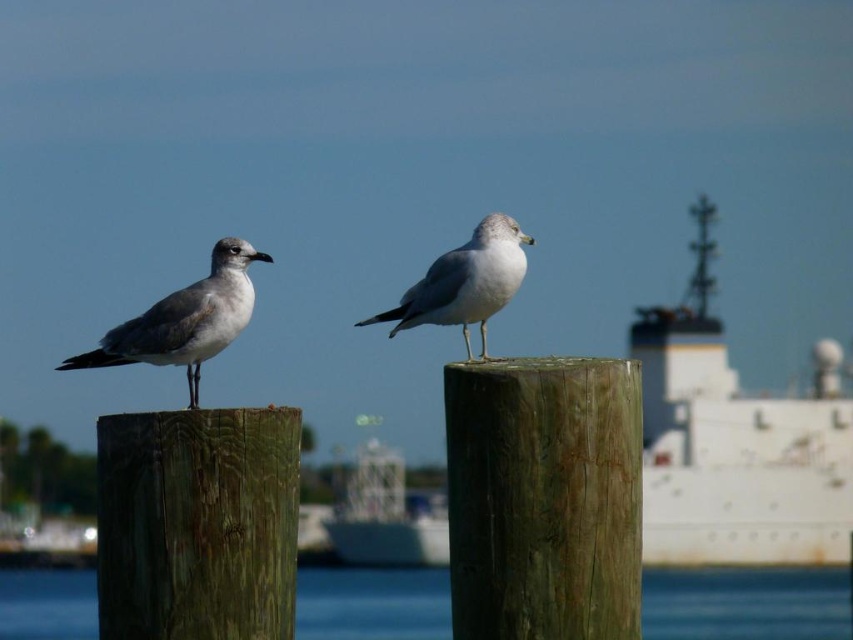
Does green weathered wood post at center lie in front of gray matte seagull at left?

Yes.

Can you confirm if green weathered wood post at center is shorter than gray matte seagull at left?

No, green weathered wood post at center is not shorter than gray matte seagull at left.

Where is `green weathered wood post at center`? The width and height of the screenshot is (853, 640). green weathered wood post at center is located at coordinates (543, 497).

Is gray matte seagull at left below white matte seagull at center?

Indeed, gray matte seagull at left is positioned under white matte seagull at center.

Does gray matte seagull at left have a smaller size compared to white matte seagull at center?

Indeed, gray matte seagull at left has a smaller size compared to white matte seagull at center.

Between point (155, 323) and point (456, 314), which one is positioned behind?

Positioned behind is point (456, 314).

At what (x,y) coordinates should I click in order to perform the action: click on gray matte seagull at left. Please return your answer as a coordinate pair (x, y). Looking at the image, I should click on (184, 321).

Does white matte ship at center have a larger size compared to white matte seagull at center?

Yes.

Is point (711, 552) closer to camera compared to point (466, 349)?

No, it is not.

Find the location of a particular element. white matte ship at center is located at coordinates (735, 442).